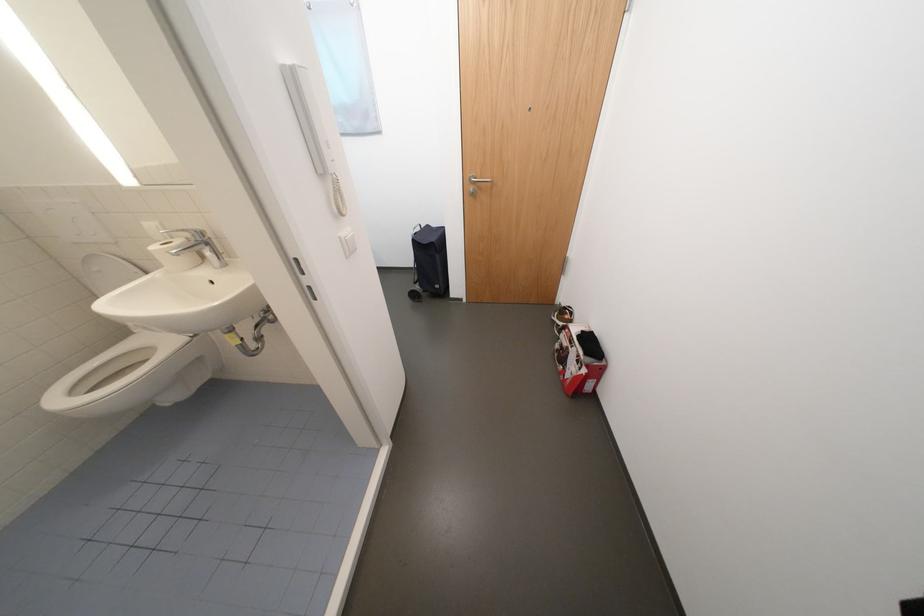
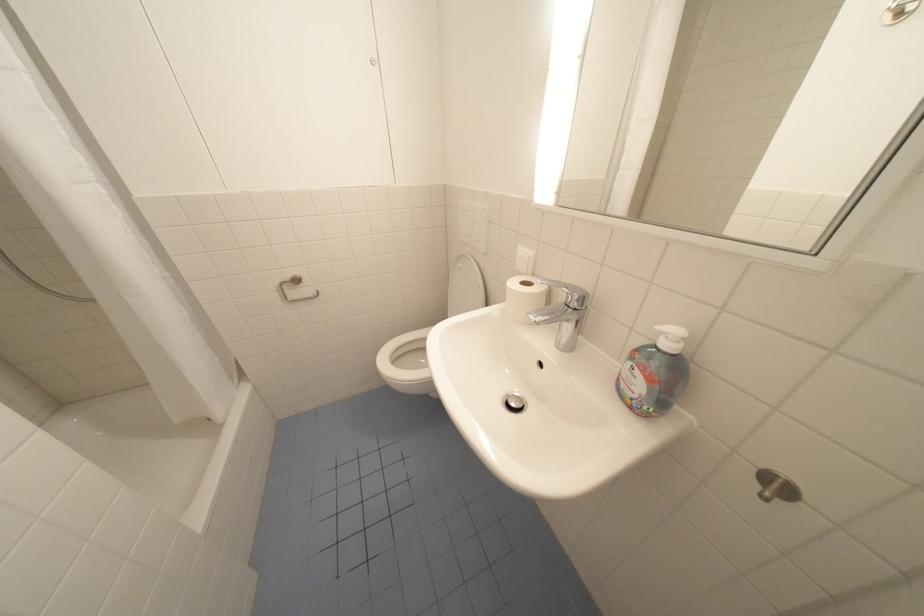
Locate, in the second image, the point that corresponds to the point at 103,245 in the first image.

(480, 248)